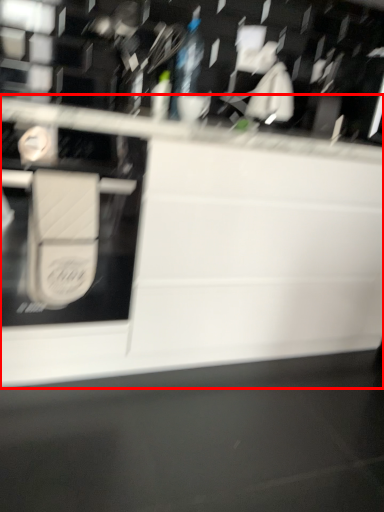
Question: Considering the relative positions of countertop (annotated by the red box) and wide in the image provided, where is countertop (annotated by the red box) located with respect to the staircase?

Choices:
 (A) right
 (B) left

Answer: (A)